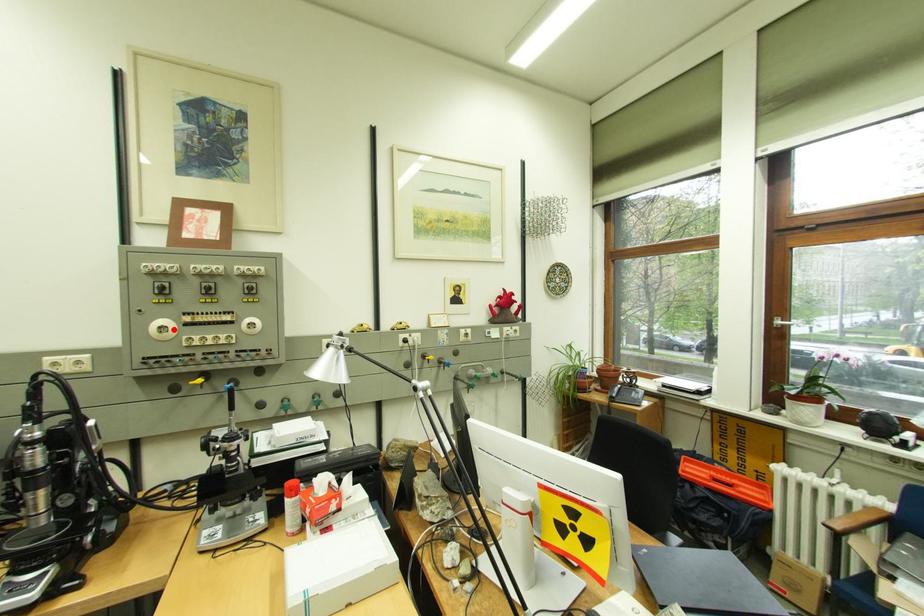
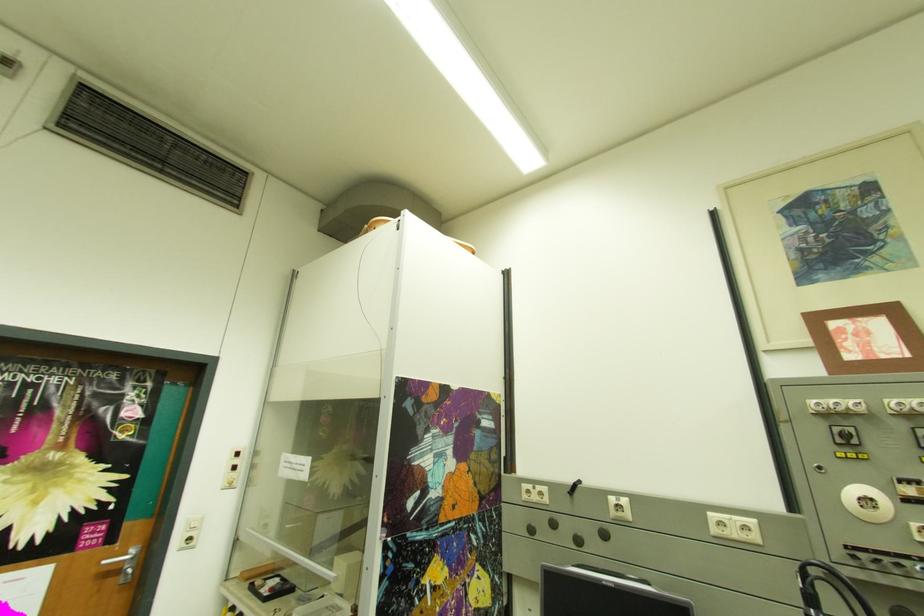
Question: I am providing you with two images of the same scene from different viewpoints. In image1, a red point is highlighted. Considering the same 3D point in image2, which of the following is correct?

Choices:
 (A) It is closer
 (B) It is farther

Answer: (A)